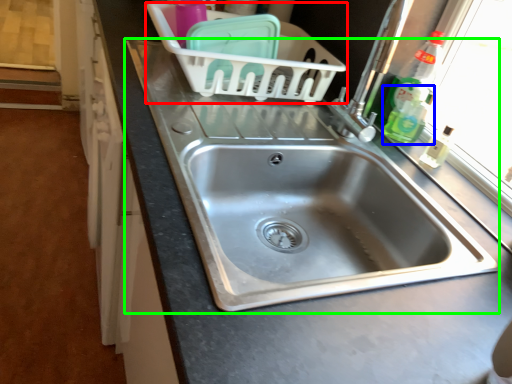
Question: Considering the real-world distances, which object is closest to basket (highlighted by a red box)? bottle (highlighted by a blue box) or sink (highlighted by a green box).

Choices:
 (A) bottle
 (B) sink

Answer: (B)